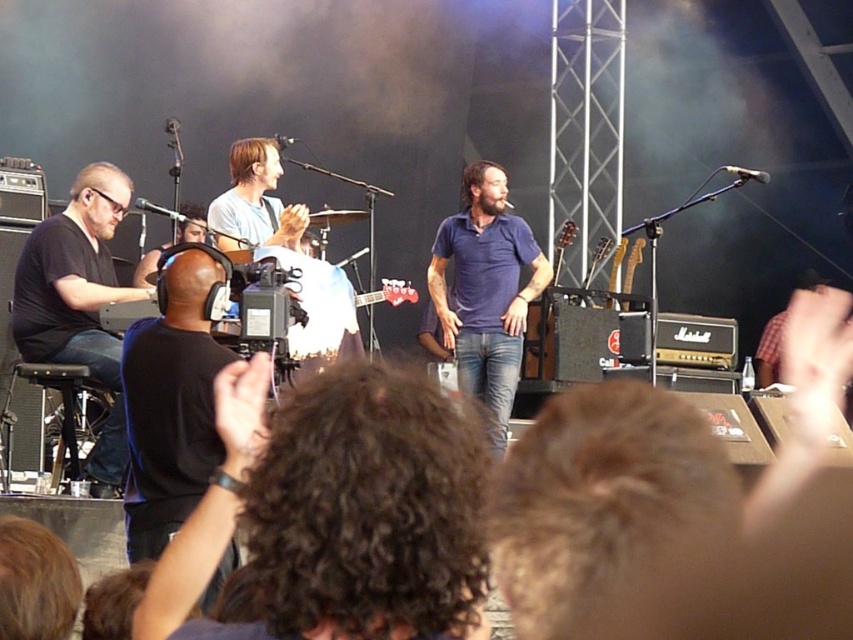
Consider the image. You are a photographer at the concert venue. You need to capture a closeup shot of the dark curly hair at lower center and blue cotton shirt at center. Considering their sizes, which one will require a wider lens to ensure both fit in the frame?

The dark curly hair at lower center has a lesser width compared to the blue cotton shirt at center, so the blue cotton shirt at center requires a wider lens to accommodate its larger size in the frame.

What object is located at the coordinates point (79, 304)?

The point (79, 304) is located on the black matte headphones at left.

You are a photographer at the concert and want to take a photo of the blue cotton shirt at center and the black matte headphones at left. Which object should you focus on first if you want to capture both in the same frame without moving the camera?

The black matte headphones at left should be focused on first because they are positioned to the left of the blue cotton shirt at center, so adjusting focus from left to right would naturally include both in the frame.